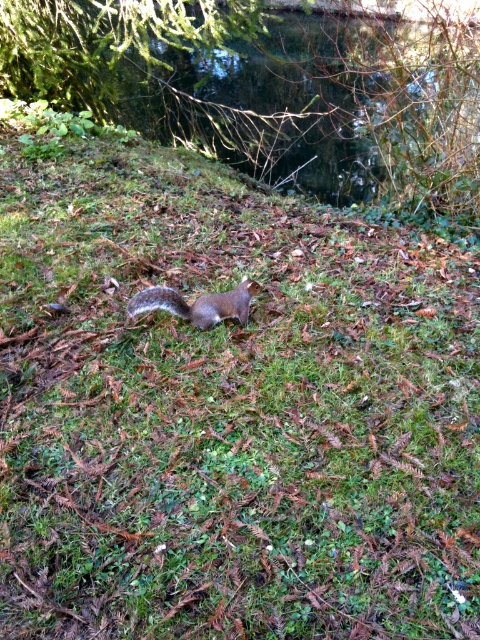
You are standing in the forest scene and want to walk from the point at coordinate (348, 198) to the point at coordinate (190, 307). Which direction should you move relative to your current position?

You should move downward and to the right because point (190, 307) is closer to the camera than point (348, 198), indicating it is lower and further right in the scene.